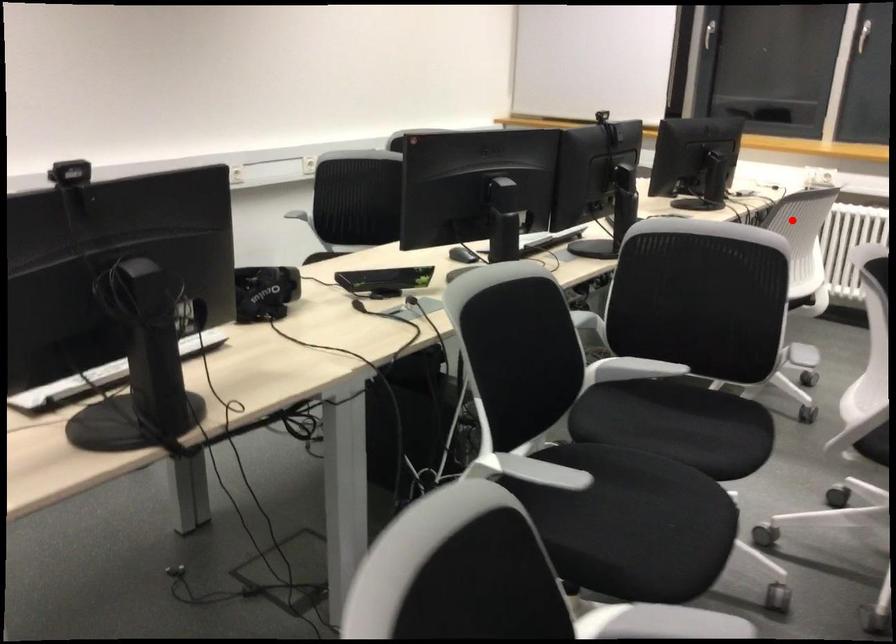
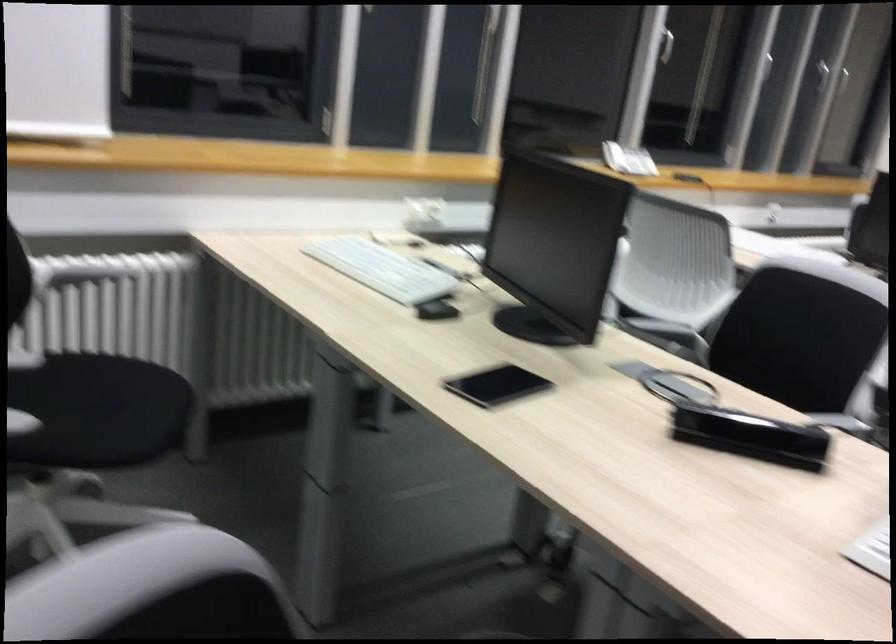
Question: I am providing you with two images of the same scene from different viewpoints. A red point is shown in image1. For the corresponding object point in image2, is it positioned nearer or farther from the camera?

Choices:
 (A) Nearer
 (B) Farther

Answer: (A)